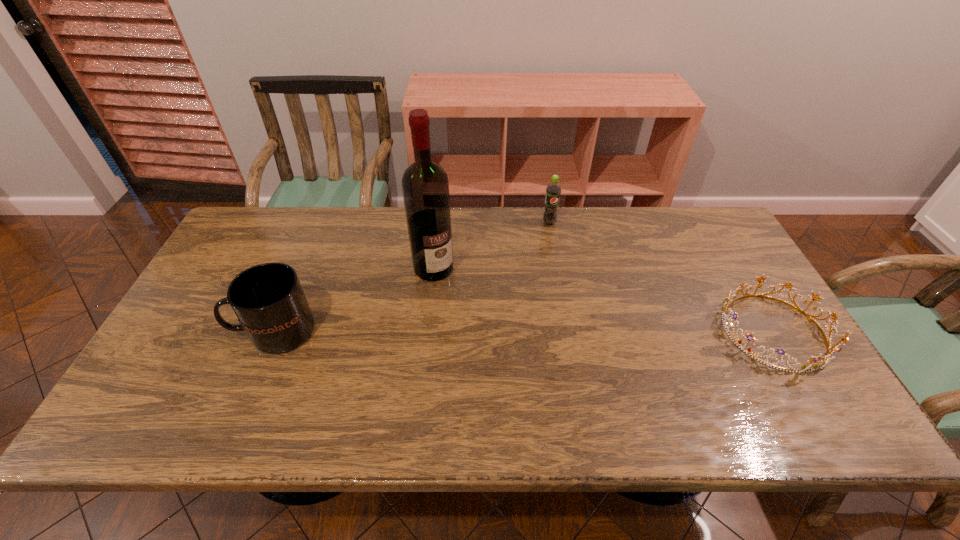
Locate an element on the screen. This screenshot has width=960, height=540. free spot between the soda and the leftmost object is located at coordinates (412, 277).

Image resolution: width=960 pixels, height=540 pixels. In order to click on vacant space that's between the tallest object and the farthest object in this screenshot , I will do `click(492, 245)`.

Where is `empty location between the alcohol and the shortest object`? This screenshot has height=540, width=960. empty location between the alcohol and the shortest object is located at coordinates (604, 300).

You are a GUI agent. You are given a task and a screenshot of the screen. Output one action in this format:
    pyautogui.click(x=<x>, y=<y>)
    Task: Click on the empty space that is in between the leftmost object and the shortest object
    This screenshot has height=540, width=960.
    Given the screenshot: What is the action you would take?
    pyautogui.click(x=525, y=331)

At what (x,y) coordinates should I click in order to perform the action: click on unoccupied position between the rightmost object and the soda. Please return your answer as a coordinate pair (x, y). Image resolution: width=960 pixels, height=540 pixels. Looking at the image, I should click on pyautogui.click(x=662, y=277).

The image size is (960, 540). Identify the location of object that is the closest to the farthest object. [425, 185].

Choose which object is the second nearest neighbor to the farthest object. Please provide its 2D coordinates. Your answer should be formatted as a tuple, i.e. [(x, y)], where the tuple contains the x and y coordinates of a point satisfying the conditions above.

[(811, 366)]

Locate an element on the screen. The width and height of the screenshot is (960, 540). free space in the image that satisfies the following two spatial constraints: 1. on the back side of the second object from left to right; 2. on the right side of the farthest object is located at coordinates (439, 222).

Where is `vacant space that satisfies the following two spatial constraints: 1. on the back side of the tallest object; 2. on the left side of the soda`? This screenshot has height=540, width=960. vacant space that satisfies the following two spatial constraints: 1. on the back side of the tallest object; 2. on the left side of the soda is located at coordinates (439, 222).